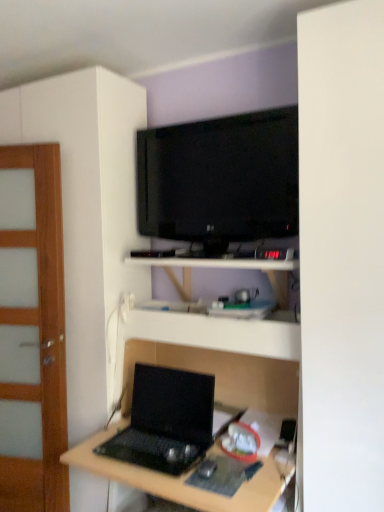
Question: In terms of width, does black matte laptop at lower center look wider or thinner when compared to wooden door at left?

Choices:
 (A) wide
 (B) thin

Answer: (A)

Question: From the image's perspective, is black matte laptop at lower center positioned above or below wooden door at left?

Choices:
 (A) above
 (B) below

Answer: (B)

Question: Which object is the closest to the wooden door at left?

Choices:
 (A) black matte laptop at lower center
 (B) black glossy tv at upper center
 (C) white matte shelf at center
 (D) matte black laptop at center
 (E) black plastic mouse at lower center

Answer: (A)

Question: Which is farther from the black matte laptop at lower center?

Choices:
 (A) black plastic mouse at lower center
 (B) matte black laptop at center
 (C) wooden door at left
 (D) white matte shelf at center
 (E) black glossy tv at upper center

Answer: (E)